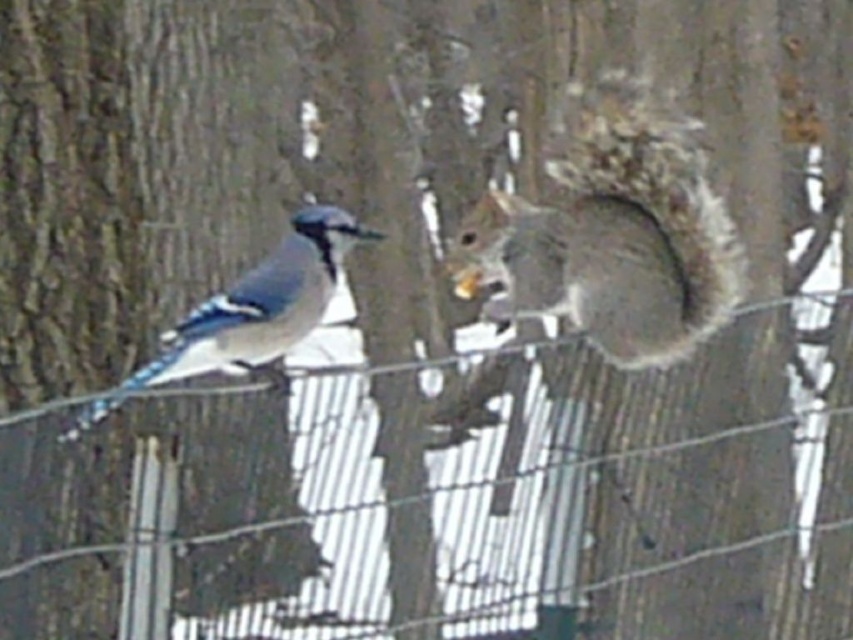
Question: Can you confirm if fuzzy gray squirrel at center is positioned to the left of gray furry squirrel at left?

Choices:
 (A) no
 (B) yes

Answer: (A)

Question: Which point is closer to the camera taking this photo?

Choices:
 (A) (273, 356)
 (B) (666, 288)

Answer: (A)

Question: Where is fuzzy gray squirrel at center located in relation to gray furry squirrel at left in the image?

Choices:
 (A) right
 (B) left

Answer: (A)

Question: Which point is closer to the camera?

Choices:
 (A) (606, 214)
 (B) (221, 355)

Answer: (B)

Question: Does fuzzy gray squirrel at center appear under gray furry squirrel at left?

Choices:
 (A) yes
 (B) no

Answer: (B)

Question: Which point appears farthest from the camera in this image?

Choices:
 (A) (614, 138)
 (B) (82, 417)

Answer: (A)